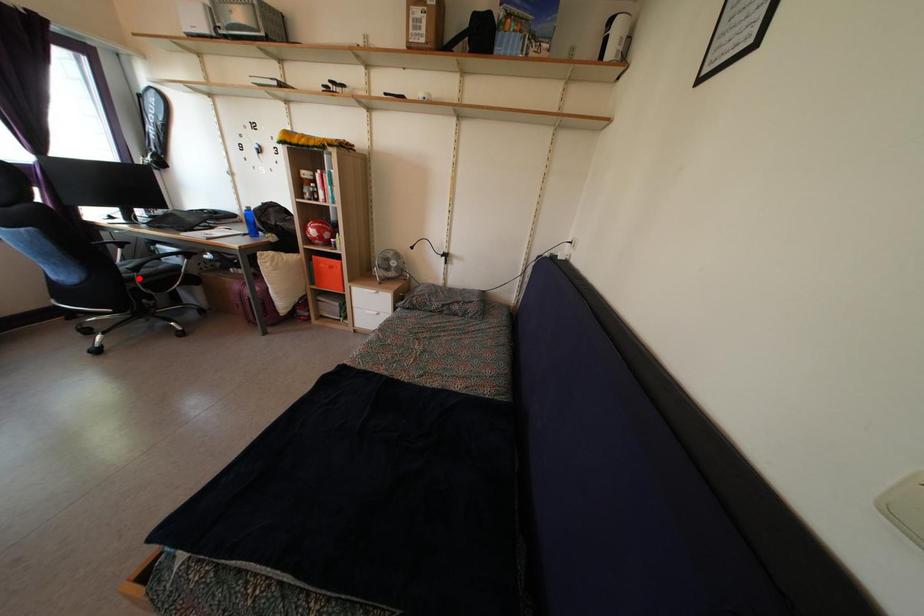
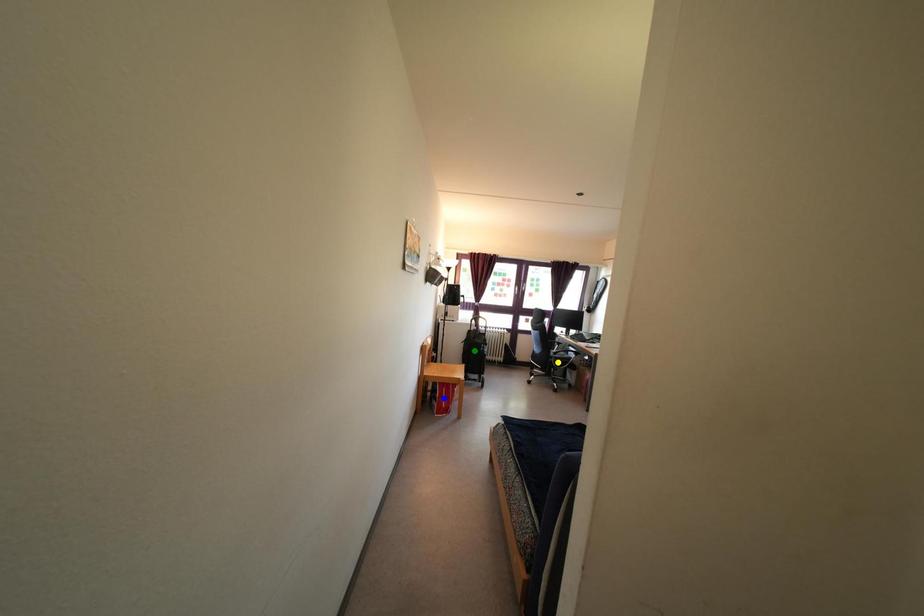
Question: I am providing you with two images of the same scene from different viewpoints. A red point is marked on the first image. You are given multiple points on the second image. Which mark in image 2 goes with the point in image 1?

Choices:
 (A) yellow point
 (B) blue point
 (C) green point

Answer: (A)